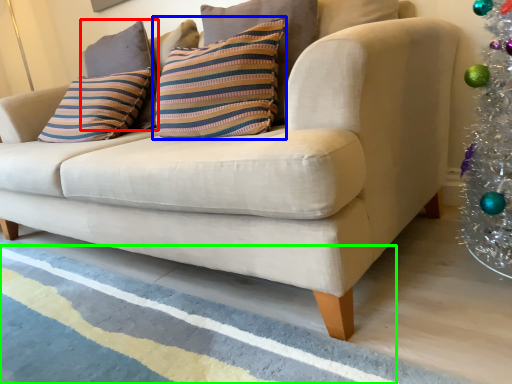
Question: Estimate the real-world distances between objects in this image. Which object is farther from pillow (highlighted by a red box), pillow (highlighted by a blue box) or stripe (highlighted by a green box)?

Choices:
 (A) pillow
 (B) stripe

Answer: (B)